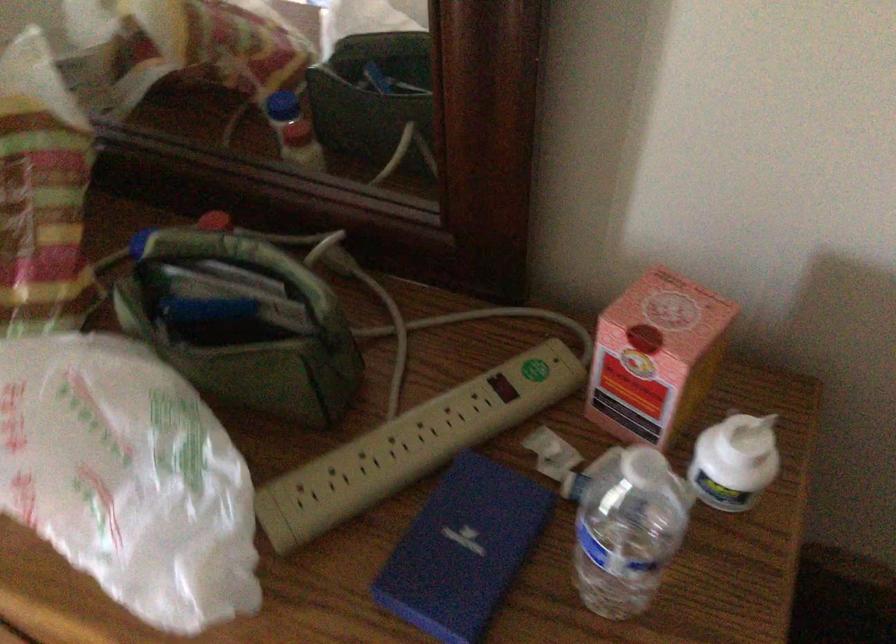
Where would you twist the plastic bottle cap? Please return your answer as a coordinate pair (x, y).

(754, 435)